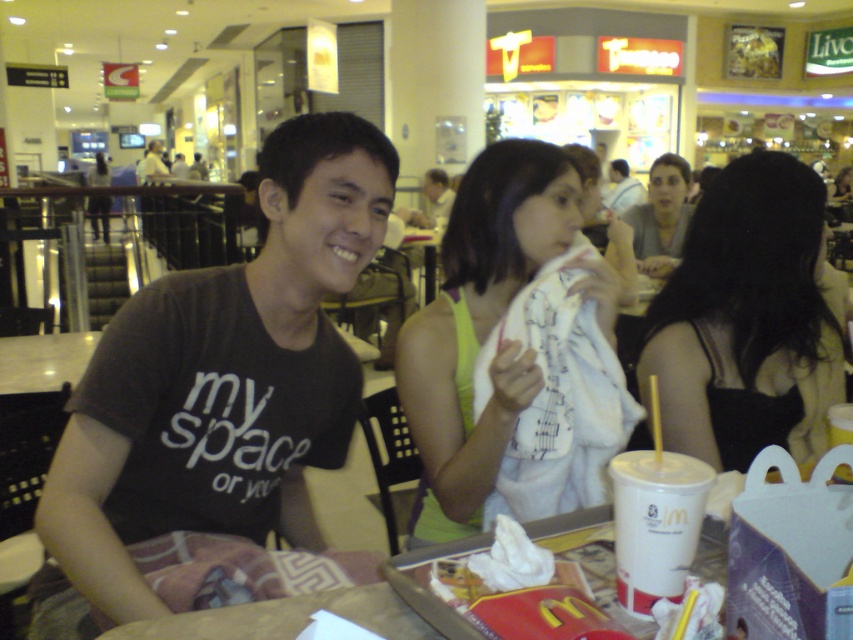
You are standing at the entrance of the food court and want to reach the McDonalds tray located at point (234, 577). The path is clear except for a 30 inch wide cart placed perpendicular to your path. Can you navigate around it?

The distance between you and the McDonalds tray at point (234, 577) is 38.63 inches. The cart is 30 inches wide. Since the cart is narrower than the available path width, you can navigate around it by moving either side of the cart to reach the tray.